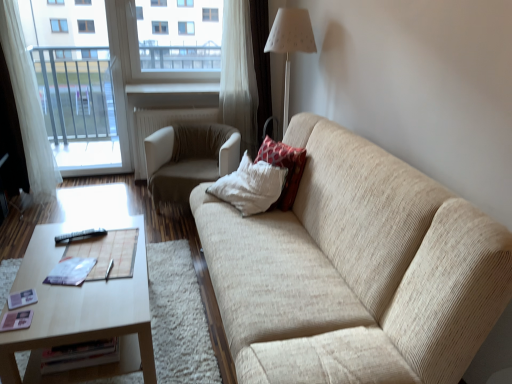
Question: Is beige fabric chair at center at the back of white fabric lampshade at upper center?

Choices:
 (A) yes
 (B) no

Answer: (B)

Question: Does white fabric lampshade at upper center turn towards beige fabric chair at center?

Choices:
 (A) no
 (B) yes

Answer: (B)

Question: Does white fabric lampshade at upper center appear on the right side of beige fabric chair at center?

Choices:
 (A) no
 (B) yes

Answer: (B)

Question: From the image's perspective, is white fabric lampshade at upper center below beige fabric chair at center?

Choices:
 (A) no
 (B) yes

Answer: (A)

Question: Can you confirm if white fabric lampshade at upper center is taller than beige fabric chair at center?

Choices:
 (A) yes
 (B) no

Answer: (A)

Question: Considering the positions of point coord(136,327) and point coord(352,345), is point coord(136,327) closer or farther from the camera than point coord(352,345)?

Choices:
 (A) farther
 (B) closer

Answer: (A)

Question: Is light brown wooden coffee table at lower left spatially inside beige fabric couch at center, or outside of it?

Choices:
 (A) outside
 (B) inside

Answer: (A)

Question: Considering their positions, is light brown wooden coffee table at lower left located in front of or behind beige fabric couch at center?

Choices:
 (A) behind
 (B) front

Answer: (A)

Question: Considering the positions of light brown wooden coffee table at lower left and beige fabric couch at center in the image, is light brown wooden coffee table at lower left wider or thinner than beige fabric couch at center?

Choices:
 (A) wide
 (B) thin

Answer: (A)

Question: From the image's perspective, is transparent glass window at upper center located above or below white sheer curtain at left?

Choices:
 (A) below
 (B) above

Answer: (B)

Question: In the image, is transparent glass window at upper center positioned in front of or behind white sheer curtain at left?

Choices:
 (A) behind
 (B) front

Answer: (A)

Question: Is transparent glass window at upper center taller or shorter than white sheer curtain at left?

Choices:
 (A) short
 (B) tall

Answer: (A)

Question: From a real-world perspective, is transparent glass window at upper center physically located above or below white sheer curtain at left?

Choices:
 (A) below
 (B) above

Answer: (B)

Question: Looking at their shapes, would you say beige fabric chair at center is wider or thinner than light brown wooden coffee table at lower left?

Choices:
 (A) thin
 (B) wide

Answer: (A)

Question: Based on their sizes in the image, would you say beige fabric chair at center is bigger or smaller than light brown wooden coffee table at lower left?

Choices:
 (A) small
 (B) big

Answer: (B)